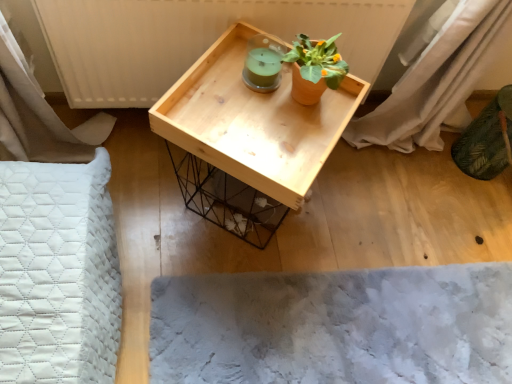
Question: Can you confirm if natural wood tray at center is shorter than terracotta clay pot at upper center?

Choices:
 (A) no
 (B) yes

Answer: (A)

Question: Is natural wood tray at center thinner than terracotta clay pot at upper center?

Choices:
 (A) yes
 (B) no

Answer: (B)

Question: Can you confirm if natural wood tray at center is taller than terracotta clay pot at upper center?

Choices:
 (A) yes
 (B) no

Answer: (A)

Question: Considering the relative positions of natural wood tray at center and terracotta clay pot at upper center in the image provided, is natural wood tray at center to the left of terracotta clay pot at upper center from the viewer's perspective?

Choices:
 (A) yes
 (B) no

Answer: (A)

Question: Does natural wood tray at center have a greater width compared to terracotta clay pot at upper center?

Choices:
 (A) yes
 (B) no

Answer: (A)

Question: Based on their positions, is natural wood tray at center located to the left or right of fuzzy gray mat at lower center?

Choices:
 (A) right
 (B) left

Answer: (B)

Question: Based on their sizes in the image, would you say natural wood tray at center is bigger or smaller than fuzzy gray mat at lower center?

Choices:
 (A) small
 (B) big

Answer: (B)

Question: From their relative heights in the image, would you say natural wood tray at center is taller or shorter than fuzzy gray mat at lower center?

Choices:
 (A) tall
 (B) short

Answer: (A)

Question: In terms of width, does natural wood tray at center look wider or thinner when compared to fuzzy gray mat at lower center?

Choices:
 (A) wide
 (B) thin

Answer: (B)

Question: Considering the relative positions of terracotta clay pot at upper center and natural wood tray at center in the image provided, is terracotta clay pot at upper center to the left or to the right of natural wood tray at center?

Choices:
 (A) left
 (B) right

Answer: (B)

Question: Is terracotta clay pot at upper center wider or thinner than natural wood tray at center?

Choices:
 (A) wide
 (B) thin

Answer: (B)

Question: Based on their sizes in the image, would you say terracotta clay pot at upper center is bigger or smaller than natural wood tray at center?

Choices:
 (A) big
 (B) small

Answer: (B)

Question: From a real-world perspective, is terracotta clay pot at upper center above or below natural wood tray at center?

Choices:
 (A) below
 (B) above

Answer: (B)

Question: Based on their sizes in the image, would you say fuzzy gray mat at lower center is bigger or smaller than terracotta clay pot at upper center?

Choices:
 (A) small
 (B) big

Answer: (B)

Question: In terms of width, does fuzzy gray mat at lower center look wider or thinner when compared to terracotta clay pot at upper center?

Choices:
 (A) thin
 (B) wide

Answer: (B)